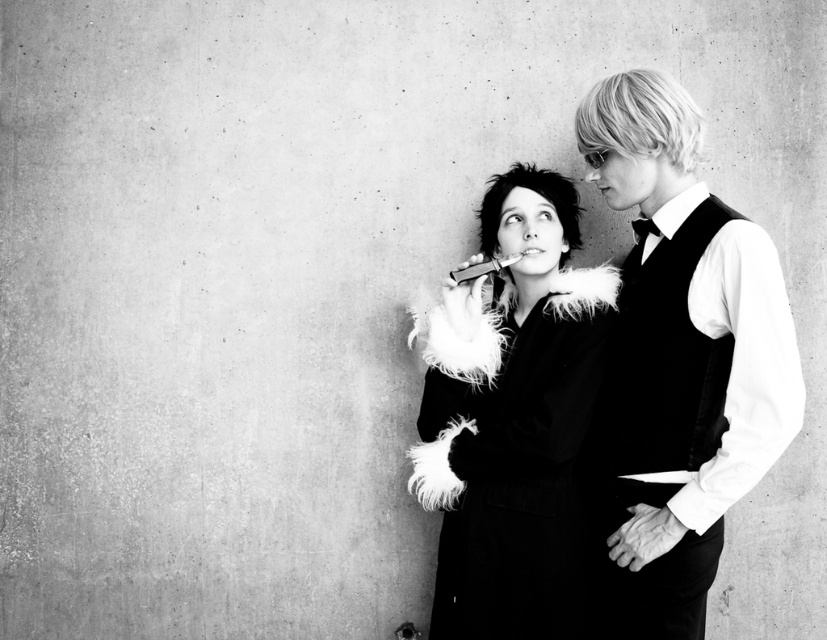
Question: Does feathered black vest at center appear under feathered black coat at center?

Choices:
 (A) yes
 (B) no

Answer: (B)

Question: Is feathered black vest at center further to the viewer compared to feathered black coat at center?

Choices:
 (A) no
 (B) yes

Answer: (A)

Question: Observing the image, what is the correct spatial positioning of feathered black vest at center in reference to feathered black coat at center?

Choices:
 (A) below
 (B) above

Answer: (B)

Question: Which of the following is the farthest from the observer?

Choices:
 (A) (543, 301)
 (B) (646, 275)

Answer: (A)